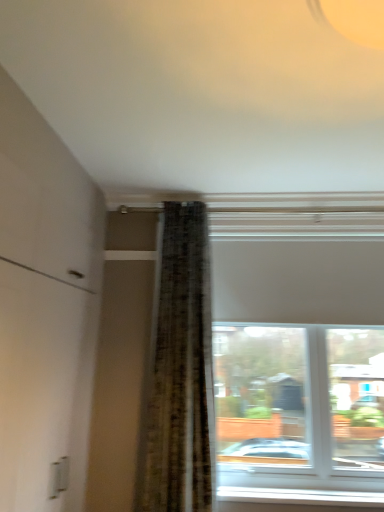
Question: Considering the relative positions of white plastic window sill at lower center and white matte window at upper center in the image provided, is white plastic window sill at lower center to the left or to the right of white matte window at upper center?

Choices:
 (A) right
 (B) left

Answer: (B)

Question: Is white plastic window sill at lower center taller or shorter than white matte window at upper center?

Choices:
 (A) short
 (B) tall

Answer: (A)

Question: Is white plastic window sill at lower center in front of or behind white matte window at upper center in the image?

Choices:
 (A) behind
 (B) front

Answer: (A)

Question: From their relative heights in the image, would you say white matte window at upper center is taller or shorter than white plastic window sill at lower center?

Choices:
 (A) tall
 (B) short

Answer: (A)

Question: From the image's perspective, is white matte window at upper center above or below white plastic window sill at lower center?

Choices:
 (A) below
 (B) above

Answer: (B)

Question: Considering their positions, is white matte window at upper center located in front of or behind white plastic window sill at lower center?

Choices:
 (A) front
 (B) behind

Answer: (A)

Question: Is white matte window at upper center inside the boundaries of white plastic window sill at lower center, or outside?

Choices:
 (A) outside
 (B) inside

Answer: (A)